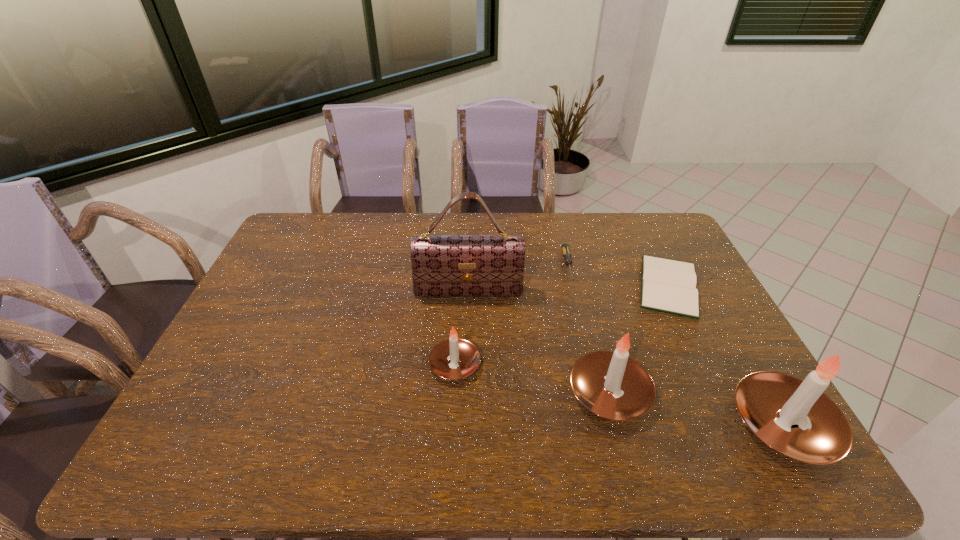
Where is `the fourth tallest object`? The height and width of the screenshot is (540, 960). the fourth tallest object is located at coordinates (454, 358).

Locate an element on the screen. the leftmost candle is located at coordinates (454, 358).

Where is `the fourth shortest object`? The image size is (960, 540). the fourth shortest object is located at coordinates (612, 385).

At what (x,y) coordinates should I click in order to perform the action: click on the second candle from left to right. Please return your answer as a coordinate pair (x, y). The width and height of the screenshot is (960, 540). Looking at the image, I should click on (612, 385).

You are a GUI agent. You are given a task and a screenshot of the screen. Output one action in this format:
    pyautogui.click(x=<x>, y=<y>)
    Task: Click on the rightmost candle
    
    Given the screenshot: What is the action you would take?
    pyautogui.click(x=794, y=417)

Image resolution: width=960 pixels, height=540 pixels. Identify the location of screwdriver. (565, 248).

Where is `the tallest object`? The image size is (960, 540). the tallest object is located at coordinates (442, 265).

Locate an element on the screen. This screenshot has width=960, height=540. hardback book is located at coordinates 667,285.

Locate an element on the screen. free space located on the back of the third shortest object is located at coordinates (460, 279).

Locate an element on the screen. free spot located on the right of the second tallest candle is located at coordinates tap(759, 393).